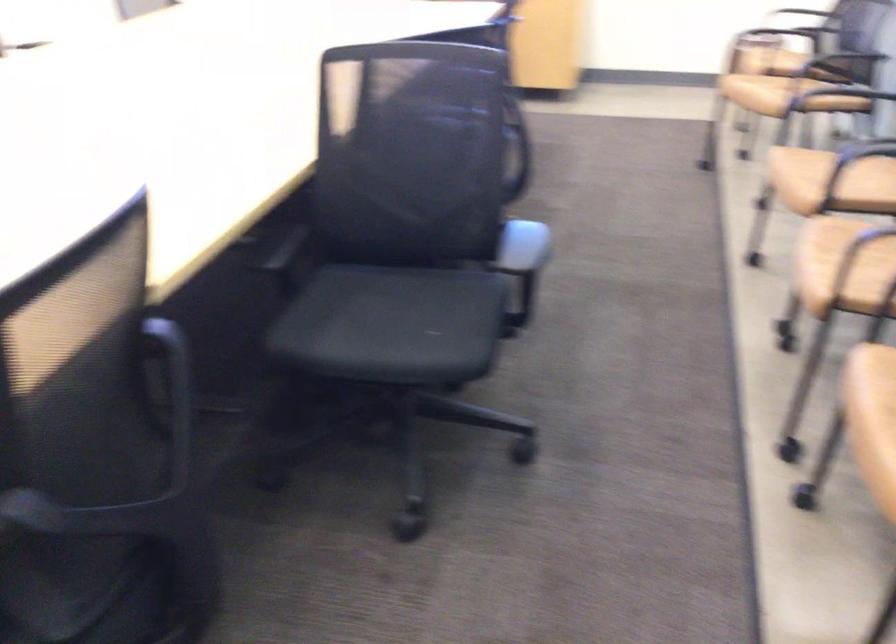
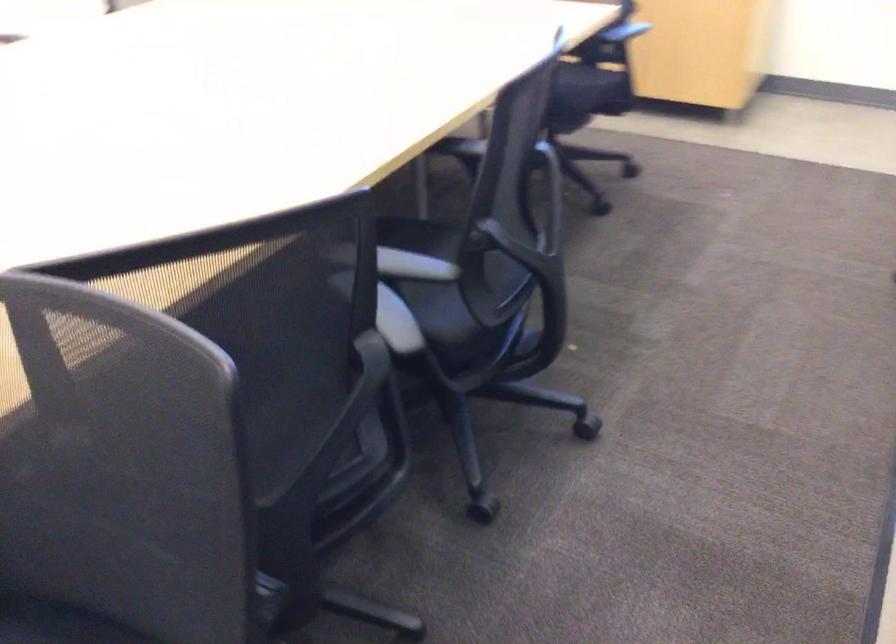
The images are taken continuously from a first-person perspective. In which direction are you moving?

The cameraman walked toward right, forward.